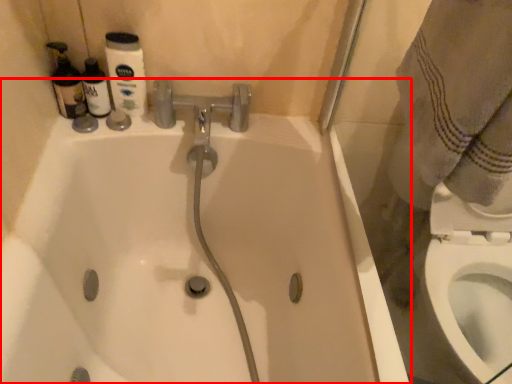
Question: From the image's perspective, what is the correct spatial relationship of bathtub (annotated by the red box) in relation to bidet?

Choices:
 (A) above
 (B) below

Answer: (A)